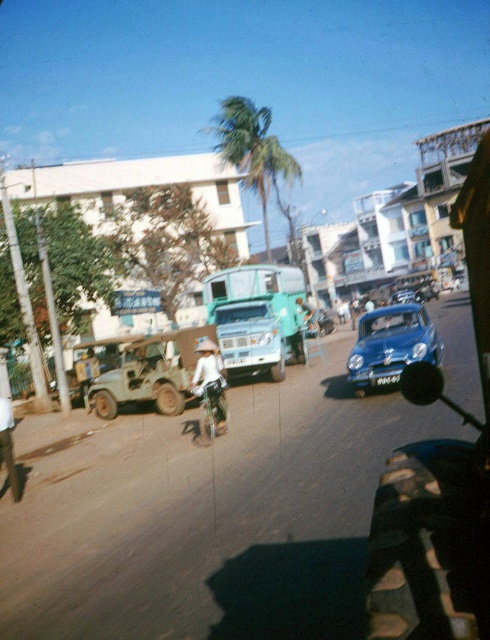
Describe the element at coordinates (258, 317) in the screenshot. The image size is (490, 640). I see `teal matte truck at center` at that location.

Find the location of a particular element. The image size is (490, 640). teal matte truck at center is located at coordinates (258, 317).

From the picture: Does teal matte truck at center appear on the left side of green leafy palm tree at center?

Indeed, teal matte truck at center is positioned on the left side of green leafy palm tree at center.

Does point (238, 312) come in front of point (251, 102)?

Yes, point (238, 312) is closer to viewer.

Locate an element on the screen. This screenshot has height=640, width=490. teal matte truck at center is located at coordinates (258, 317).

Find the location of a particular element. teal matte truck at center is located at coordinates [x=258, y=317].

Describe the element at coordinates (255, 156) in the screenshot. I see `green leafy palm tree at center` at that location.

Measure the distance between point (286, 208) and camera.

Point (286, 208) and camera are 459.09 feet apart.

Locate an element on the screen. green leafy palm tree at center is located at coordinates (255, 156).